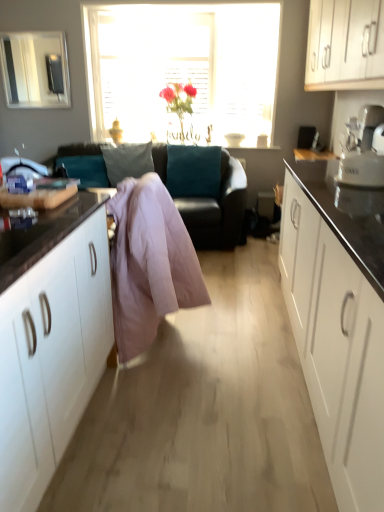
Question: Considering the positions of point (342, 13) and point (144, 37), is point (342, 13) closer or farther from the camera than point (144, 37)?

Choices:
 (A) closer
 (B) farther

Answer: (A)

Question: In the image, is white glossy cabinets at upper right positioned in front of or behind translucent glass vase at center?

Choices:
 (A) front
 (B) behind

Answer: (A)

Question: Which is nearer to the teal leather couch at center?

Choices:
 (A) translucent glass vase at center
 (B) white glossy cabinets at upper right
 (C) clear glass window screen at upper left
 (D) light pink fabric at center

Answer: (A)

Question: Estimate the real-world distances between objects in this image. Which object is farther from the translucent glass vase at center?

Choices:
 (A) clear glass window screen at upper left
 (B) teal leather couch at center
 (C) white glossy cabinets at upper right
 (D) light pink fabric at center

Answer: (D)